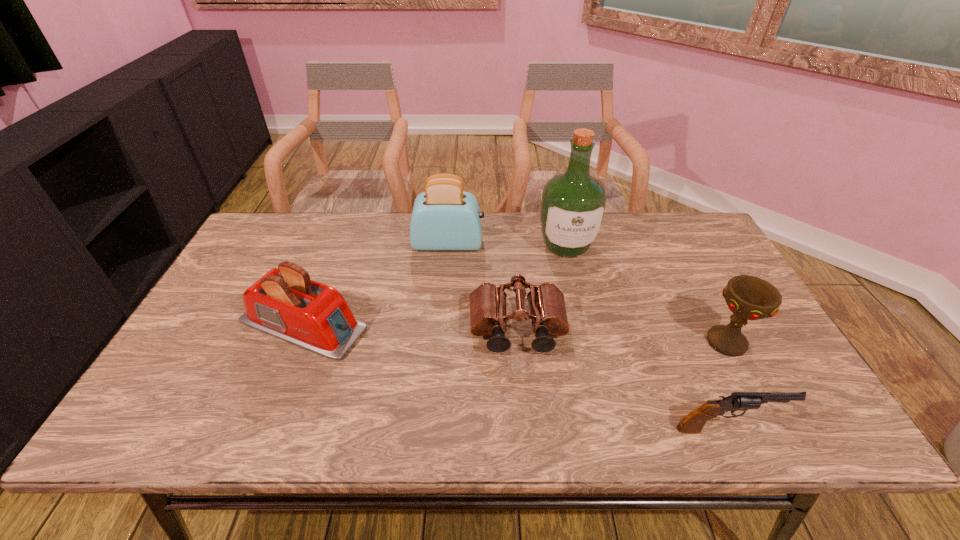
The width and height of the screenshot is (960, 540). Find the location of `liquor`. liquor is located at coordinates (573, 205).

Find the location of a particular element. the fifth shortest object is located at coordinates (444, 217).

Identify the location of the right toaster. Image resolution: width=960 pixels, height=540 pixels. (444, 217).

The width and height of the screenshot is (960, 540). Find the location of `the left toaster`. the left toaster is located at coordinates (285, 303).

The width and height of the screenshot is (960, 540). What are the coordinates of `the leftmost object` in the screenshot? It's located at (285, 303).

Image resolution: width=960 pixels, height=540 pixels. Find the location of `chalice`. chalice is located at coordinates (750, 298).

Where is `gun`? gun is located at coordinates (692, 423).

Where is `binoculars`? binoculars is located at coordinates (548, 314).

At what (x,y) coordinates should I click in order to perform the action: click on vacant space located 0.130m on the front-facing side of the tallest object. Please return your answer as a coordinate pair (x, y). The height and width of the screenshot is (540, 960). Looking at the image, I should click on (578, 295).

What are the coordinates of `vacant space located 0.120m on the side of the fifth shortest object with the lever` in the screenshot? It's located at (521, 244).